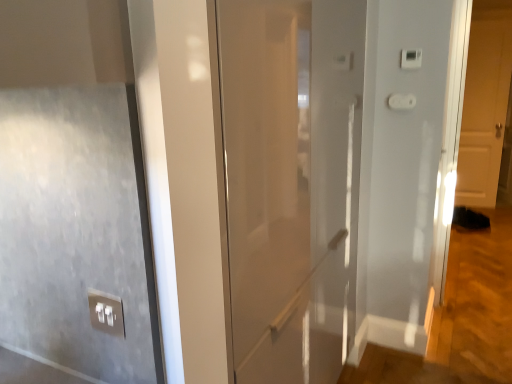
Question: From the image's perspective, is white matte door at right, marked as the 2th door in a left-to-right arrangement, above or below white plastic light switch at upper right, acting as the 1th light switch starting from the top?

Choices:
 (A) below
 (B) above

Answer: (B)

Question: In terms of width, does white matte door at right, arranged as the first door when viewed from the right, look wider or thinner when compared to white plastic light switch at upper right, acting as the second light switch starting from the bottom?

Choices:
 (A) thin
 (B) wide

Answer: (B)

Question: Which is nearer to the white glossy door at center, acting as the second door starting from the right?

Choices:
 (A) white plastic light switch at upper right, acting as the second light switch starting from the bottom
 (B) satin silver switch at lower left
 (C) white matte door at right, arranged as the first door when viewed from the right
 (D) white plastic light switch at upper right, the 2th light switch in the top-to-bottom sequence

Answer: (B)

Question: Which object is positioned closest to the white plastic light switch at upper right, the 1th light switch ordered from the bottom?

Choices:
 (A) satin silver switch at lower left
 (B) white glossy door at center, the second door in the back-to-front sequence
 (C) white matte door at right, arranged as the first door when viewed from the right
 (D) white plastic light switch at upper right, acting as the 1th light switch starting from the top

Answer: (D)